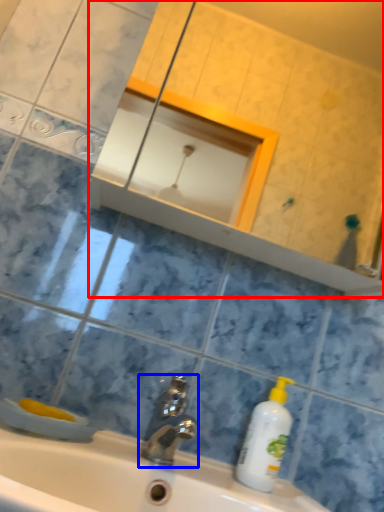
Question: Which object is closer to the camera taking this photo, mirror (highlighted by a red box) or tap (highlighted by a blue box)?

Choices:
 (A) mirror
 (B) tap

Answer: (B)